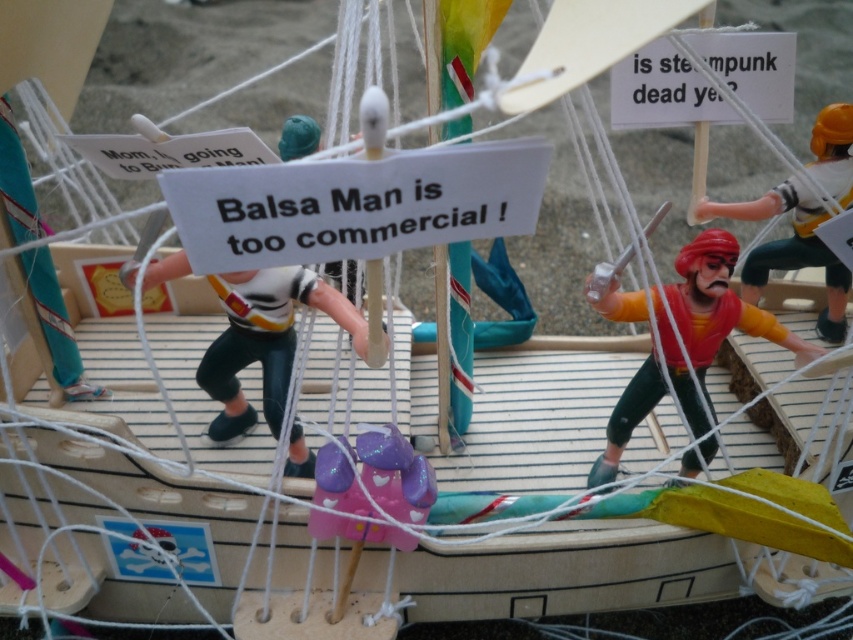
What is located at the coordinates point (662, 90) in the image?

The point (662, 90) indicates a white paper sign at upper right.

You are a child who wants to play with both the white paper sign at center and the purple glittery toy at center. Which one can you hold in one hand more easily?

The purple glittery toy at center can be held in one hand more easily because it is smaller than the white paper sign at center.

You are standing at the position of the pirate ship model and want to place a new treasure chest between the two points marked as point (496, 216) and point (347, 525). Which point should the chest be closer to so that it is placed in front of the other point?

The treasure chest should be placed closer to point (496, 216) because it is in front of point (347, 525), so placing it near the front point ensures it is in front of the other point.